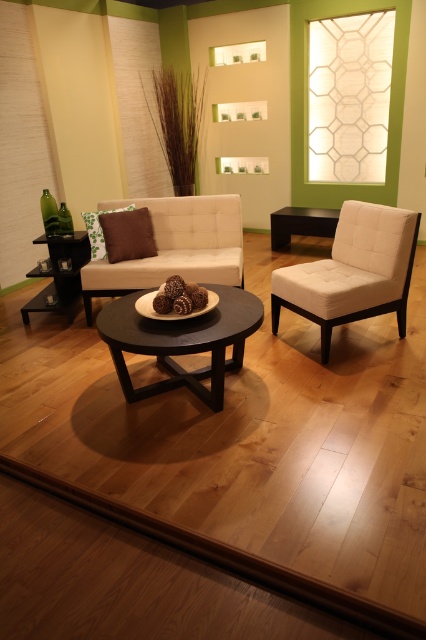
Does brown fabric pillow at center appear on the right side of black matte table at center?

No, brown fabric pillow at center is not to the right of black matte table at center.

Can you confirm if brown fabric pillow at center is positioned below black matte table at center?

Indeed, brown fabric pillow at center is positioned under black matte table at center.

This screenshot has width=426, height=640. In order to click on brown fabric pillow at center in this screenshot , I will do `click(127, 234)`.

This screenshot has height=640, width=426. Identify the location of brown fabric pillow at center. (127, 234).

Does beige fabric couch at center have a smaller size compared to black matte table at center?

Incorrect, beige fabric couch at center is not smaller in size than black matte table at center.

This screenshot has width=426, height=640. Describe the element at coordinates (175, 246) in the screenshot. I see `beige fabric couch at center` at that location.

Locate an element on the screen. The image size is (426, 640). beige fabric couch at center is located at coordinates (175, 246).

Does white fabric chair at center have a lesser height compared to black wood table at center?

No.

Between white fabric chair at center and black wood table at center, which one has less height?

black wood table at center

Identify the location of white fabric chair at center. Image resolution: width=426 pixels, height=640 pixels. (353, 272).

Where is `white fabric chair at center`? white fabric chair at center is located at coordinates (353, 272).